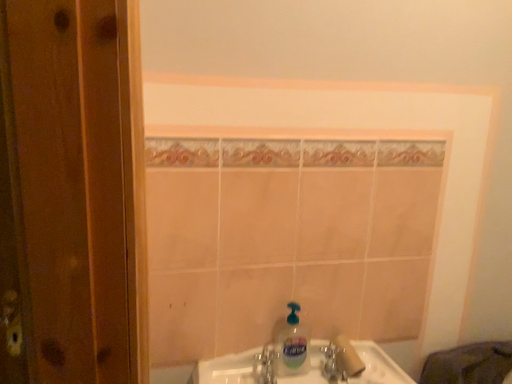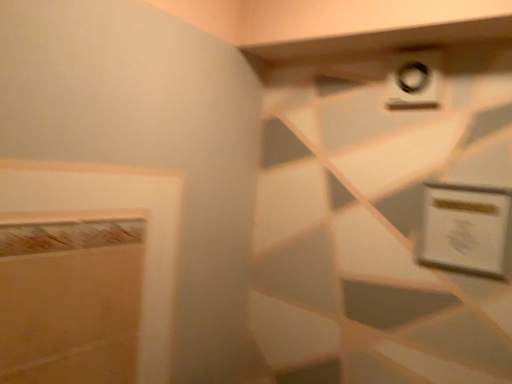
Question: How did the camera likely rotate when shooting the video?

Choices:
 (A) rotated left
 (B) rotated right

Answer: (B)